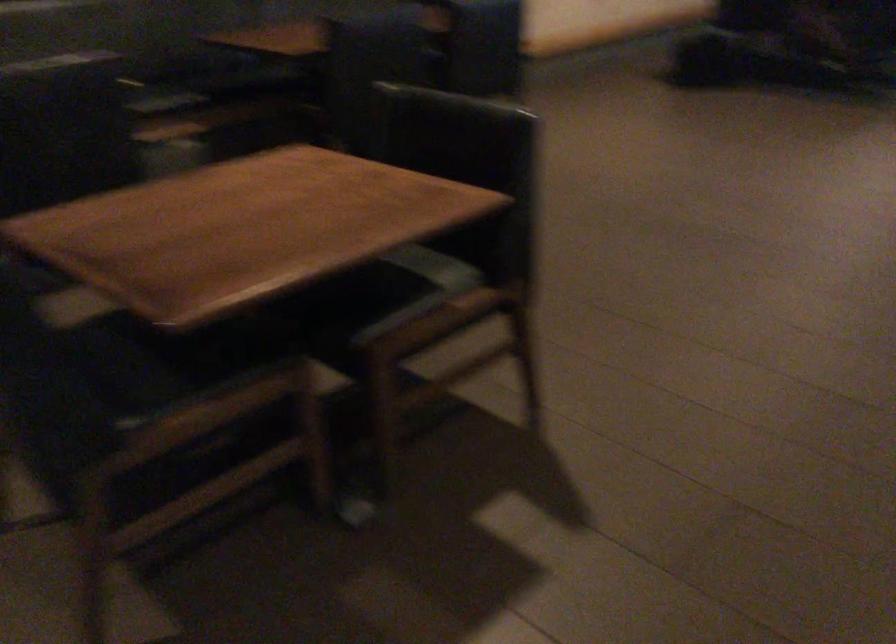
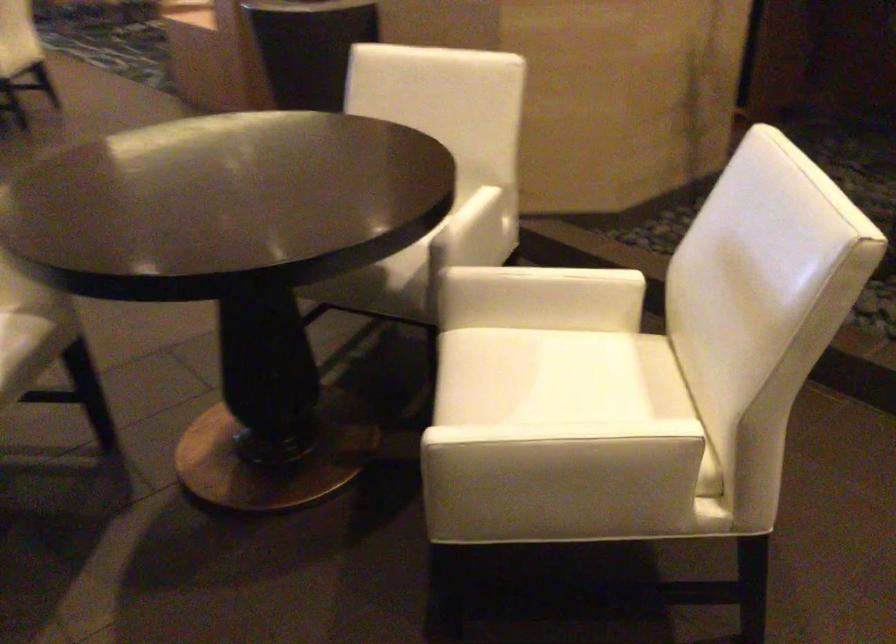
The first image is from the beginning of the video and the second image is from the end. How did the camera likely rotate when shooting the video?

The camera's rotation is toward right-down.